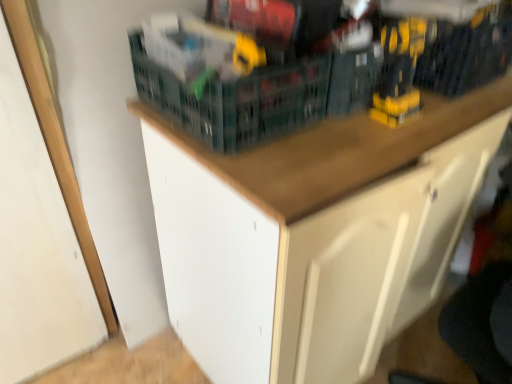
Question: Can we say wooden cabinet at upper center lies outside yellow plastic drill at upper right, positioned as the second toy in left-to-right order?

Choices:
 (A) yes
 (B) no

Answer: (A)

Question: Is wooden cabinet at upper center turned away from yellow plastic drill at upper right, the 1th toy viewed from the right?

Choices:
 (A) no
 (B) yes

Answer: (A)

Question: From a real-world perspective, is wooden cabinet at upper center on yellow plastic drill at upper right, the 1th toy viewed from the right?

Choices:
 (A) no
 (B) yes

Answer: (A)

Question: Is wooden cabinet at upper center thinner than yellow plastic drill at upper right, positioned as the second toy in left-to-right order?

Choices:
 (A) no
 (B) yes

Answer: (A)

Question: Does wooden cabinet at upper center turn towards yellow plastic drill at upper right, the 1th toy viewed from the right?

Choices:
 (A) no
 (B) yes

Answer: (A)

Question: From a real-world perspective, is wooden cabinet at upper center positioned under yellow plastic drill at upper right, positioned as the second toy in left-to-right order, based on gravity?

Choices:
 (A) no
 (B) yes

Answer: (B)

Question: Does wooden cabinet at upper center have a greater height compared to white matte drawer at lower right?

Choices:
 (A) yes
 (B) no

Answer: (A)

Question: Is there a large distance between wooden cabinet at upper center and white matte drawer at lower right?

Choices:
 (A) no
 (B) yes

Answer: (A)

Question: Is wooden cabinet at upper center looking in the opposite direction of white matte drawer at lower right?

Choices:
 (A) no
 (B) yes

Answer: (A)

Question: Is the position of wooden cabinet at upper center more distant than that of white matte drawer at lower right?

Choices:
 (A) yes
 (B) no

Answer: (A)

Question: Considering the relative positions of wooden cabinet at upper center and white matte drawer at lower right in the image provided, is wooden cabinet at upper center in front of white matte drawer at lower right?

Choices:
 (A) no
 (B) yes

Answer: (A)

Question: Can you confirm if wooden cabinet at upper center is thinner than white matte drawer at lower right?

Choices:
 (A) yes
 (B) no

Answer: (A)

Question: Is green plastic basket at upper center aimed at yellow plastic drill at upper right, the 1th toy viewed from the right?

Choices:
 (A) no
 (B) yes

Answer: (A)